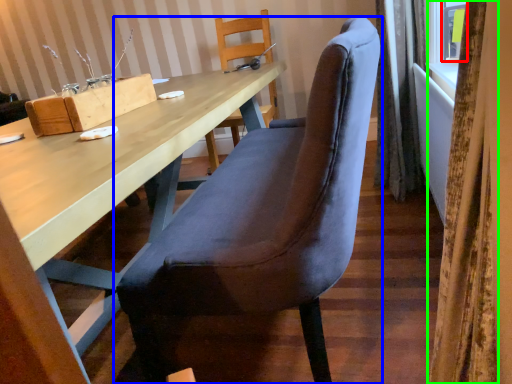
Question: Which object is the farthest from window (highlighted by a red box)? Choose among these: chair (highlighted by a blue box) or curtain (highlighted by a green box).

Choices:
 (A) chair
 (B) curtain

Answer: (B)